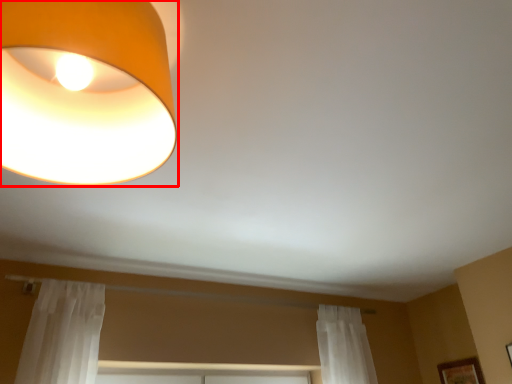
Question: Observing the image, what is the correct spatial positioning of lamp (annotated by the red box) in reference to picture frame?

Choices:
 (A) right
 (B) left

Answer: (B)